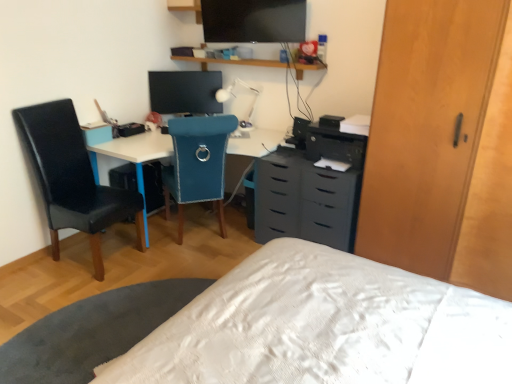
Identify the location of free spot in front of white plastic desk at center. The height and width of the screenshot is (384, 512). (110, 302).